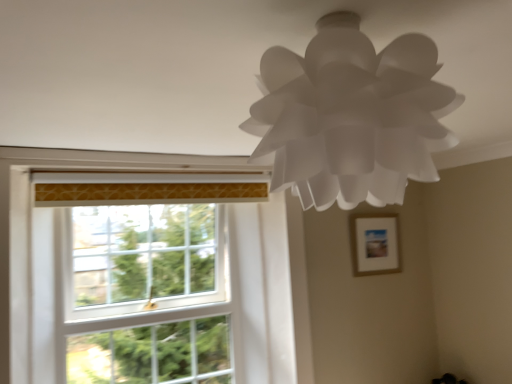
Question: Is wooden picture frame at upper right in front of white glass window screen at left?

Choices:
 (A) no
 (B) yes

Answer: (A)

Question: Does wooden picture frame at upper right have a larger size compared to white glass window screen at left?

Choices:
 (A) no
 (B) yes

Answer: (A)

Question: Would you consider wooden picture frame at upper right to be distant from white glass window screen at left?

Choices:
 (A) no
 (B) yes

Answer: (B)

Question: Is wooden picture frame at upper right wider than white glass window screen at left?

Choices:
 (A) no
 (B) yes

Answer: (A)

Question: Does wooden picture frame at upper right lie behind white glass window screen at left?

Choices:
 (A) no
 (B) yes

Answer: (B)

Question: Looking at the image, does white paper lamp at upper center seem bigger or smaller compared to white glass window screen at left?

Choices:
 (A) big
 (B) small

Answer: (B)

Question: Which is correct: white paper lamp at upper center is inside white glass window screen at left, or outside of it?

Choices:
 (A) inside
 (B) outside

Answer: (B)

Question: From a real-world perspective, is white paper lamp at upper center positioned above or below white glass window screen at left?

Choices:
 (A) above
 (B) below

Answer: (A)

Question: From the image's perspective, relative to white glass window screen at left, is white paper lamp at upper center above or below?

Choices:
 (A) above
 (B) below

Answer: (A)

Question: From the image's perspective, is wooden picture frame at upper right above or below white paper lamp at upper center?

Choices:
 (A) below
 (B) above

Answer: (A)

Question: Considering the positions of wooden picture frame at upper right and white paper lamp at upper center in the image, is wooden picture frame at upper right taller or shorter than white paper lamp at upper center?

Choices:
 (A) short
 (B) tall

Answer: (B)

Question: Is wooden picture frame at upper right situated inside white paper lamp at upper center or outside?

Choices:
 (A) outside
 (B) inside

Answer: (A)

Question: Does point (368, 243) appear closer or farther from the camera than point (309, 157)?

Choices:
 (A) farther
 (B) closer

Answer: (A)

Question: From their relative heights in the image, would you say white glass window screen at left is taller or shorter than white paper lamp at upper center?

Choices:
 (A) tall
 (B) short

Answer: (A)

Question: From the image's perspective, is white glass window screen at left above or below white paper lamp at upper center?

Choices:
 (A) below
 (B) above

Answer: (A)